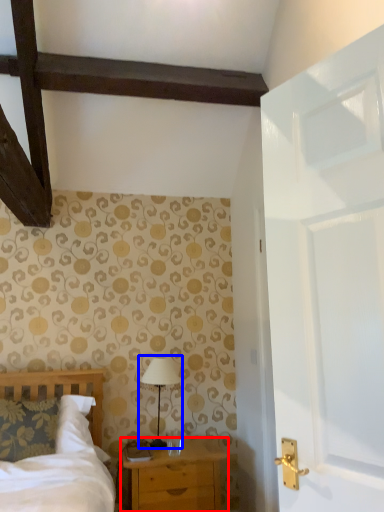
Question: Which of the following is the closest to the observer, chest of drawers (highlighted by a red box) or table lamp (highlighted by a blue box)?

Choices:
 (A) chest of drawers
 (B) table lamp

Answer: (A)